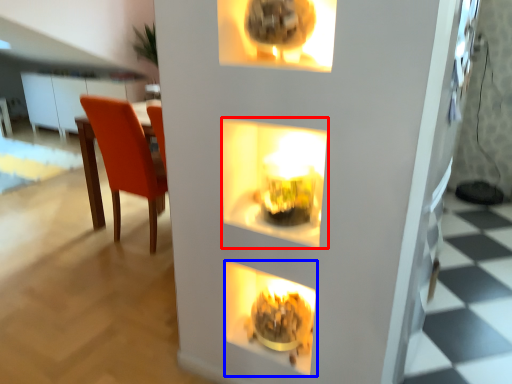
Question: Which object appears closest to the camera in this image, shelf (highlighted by a red box) or fireplace (highlighted by a blue box)?

Choices:
 (A) shelf
 (B) fireplace

Answer: (A)